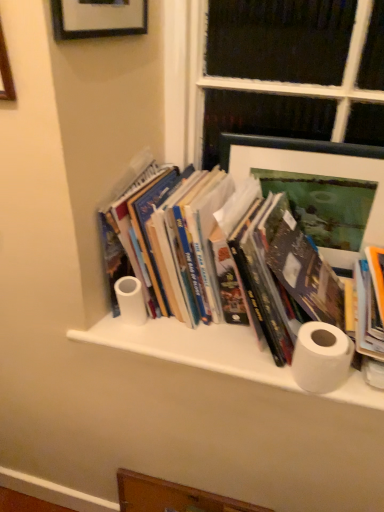
Question: Looking at their shapes, would you say white matte toilet paper at center, placed as the first toilet paper when sorted from back to front, is wider or thinner than white matte cabinet at center?

Choices:
 (A) thin
 (B) wide

Answer: (A)

Question: Is white matte toilet paper at center, the first toilet paper viewed from the left, taller or shorter than white matte cabinet at center?

Choices:
 (A) short
 (B) tall

Answer: (B)

Question: Which object is the farthest from the wooden drawer at lower center?

Choices:
 (A) hardcover books at center
 (B) brushed metal picture frame at upper left, the second picture frame from the bottom
 (C) matte green picture frame at upper right, which is counted as the 1th picture frame, starting from the bottom
 (D) white matte toilet paper at right, the 1th toilet paper when ordered from right to left
 (E) white matte toilet paper at center, placed as the first toilet paper when sorted from back to front

Answer: (B)

Question: Estimate the real-world distances between objects in this image. Which object is farther from the white matte toilet paper at center, the 2th toilet paper viewed from the right?

Choices:
 (A) matte green picture frame at upper right, the 2th picture frame viewed from the top
 (B) brushed metal picture frame at upper left, acting as the second picture frame starting from the right
 (C) white matte cabinet at center
 (D) hardcover books at center
 (E) white matte toilet paper at right, placed as the second toilet paper when sorted from back to front

Answer: (A)